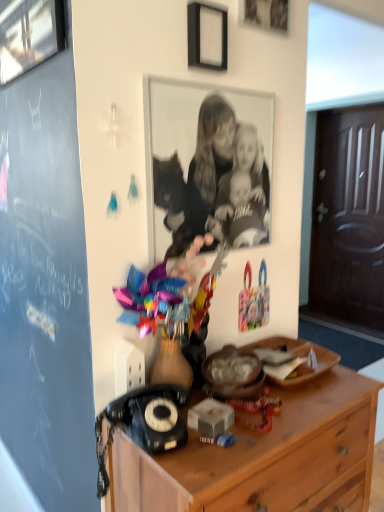
This screenshot has height=512, width=384. Identify the location of vacant region under wooden plate at center (from a real-world perspective). (284, 364).